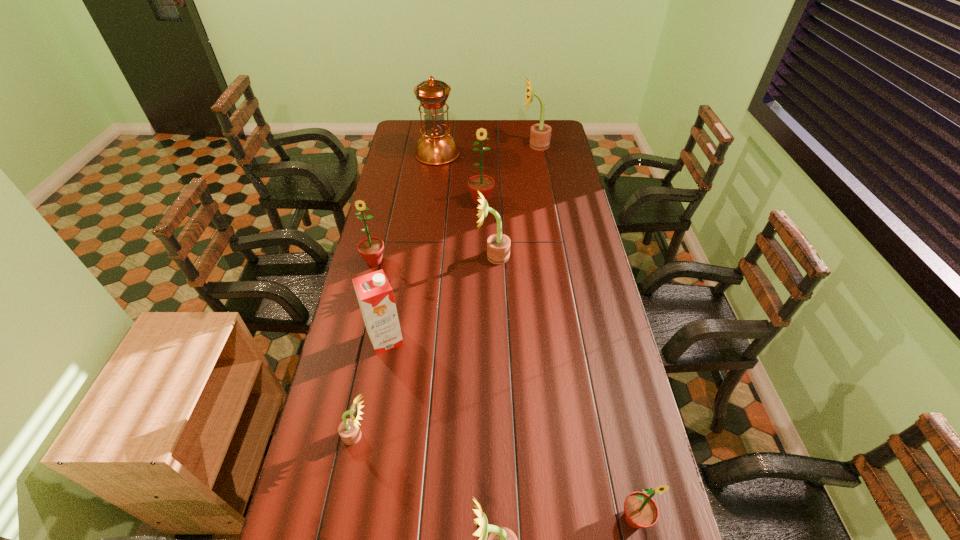
You are a GUI agent. You are given a task and a screenshot of the screen. Output one action in this format:
    pyautogui.click(x=<x>, y=<y>)
    Task: Click on the oil lamp
    
    Given the screenshot: What is the action you would take?
    pyautogui.click(x=435, y=147)

Identify the location of the farthest yellow sunflower. The height and width of the screenshot is (540, 960). (540, 134).

Locate an element on the screen. The height and width of the screenshot is (540, 960). the biggest yellow sunflower is located at coordinates (540, 134).

This screenshot has width=960, height=540. What are the coordinates of `the sixth nearest sunflower` in the screenshot? It's located at (483, 183).

Find the location of `the seventh nearest object`. the seventh nearest object is located at coordinates (483, 183).

What are the coordinates of `the third smallest yellow sunflower` in the screenshot? It's located at (498, 245).

Identify the location of the leftmost green sunflower. (371, 249).

Locate an element on the screen. This screenshot has width=960, height=540. the second nearest green sunflower is located at coordinates coord(371,249).

At what (x,y) coordinates should I click in order to perform the action: click on the sixth farthest object. Please return your answer as a coordinate pair (x, y). The height and width of the screenshot is (540, 960). Looking at the image, I should click on (375, 295).

What are the coordinates of `the nearest green sunflower` in the screenshot? It's located at (641, 511).